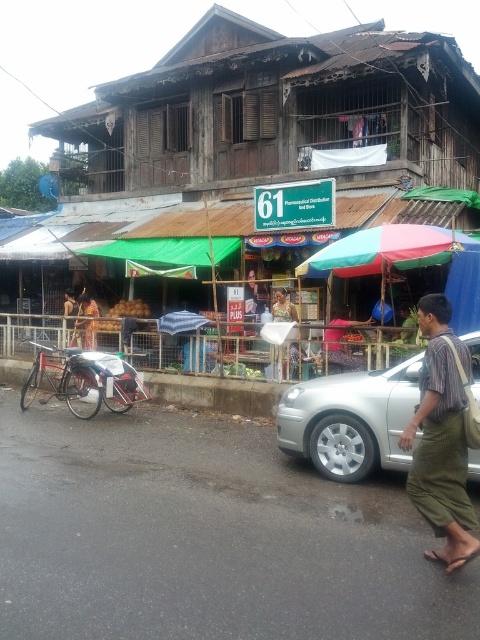
Is point (408, 368) more distant than point (386, 259)?

No, it is in front of (386, 259).

Does silver metallic car at center have a smaller size compared to multicolored fabric umbrella at center?

Yes, silver metallic car at center is smaller than multicolored fabric umbrella at center.

Where is `silver metallic car at center`? silver metallic car at center is located at coordinates (350, 420).

Between green fabric pants at lower right and multicolored fabric umbrella at center, which one appears on the right side from the viewer's perspective?

Positioned to the right is multicolored fabric umbrella at center.

From the picture: Is green fabric pants at lower right positioned at the back of multicolored fabric umbrella at center?

No, it is not.

Is point (459, 392) farther from camera compared to point (382, 234)?

No, it is not.

This screenshot has height=640, width=480. Identify the location of green fabric pants at lower right. (442, 438).

From the picture: Who is lower down, wooden hut at center or multicolored fabric umbrella at center?

multicolored fabric umbrella at center

The image size is (480, 640). In order to click on wooden hut at center in this screenshot , I will do `click(242, 163)`.

Locate an element on the screen. wooden hut at center is located at coordinates (242, 163).